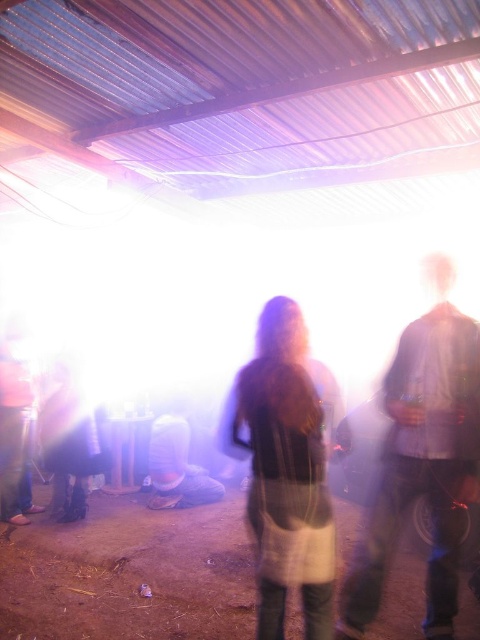
Question: Does shiny black boots at lower left have a lesser width compared to matte gray hat at center?

Choices:
 (A) no
 (B) yes

Answer: (B)

Question: Among these objects, which one is farthest from the camera?

Choices:
 (A) matte gray hat at center
 (B) light brown fabric dress at center

Answer: (A)

Question: Among these objects, which one is nearest to the camera?

Choices:
 (A) matte black pants at left
 (B) matte gray hat at center
 (C) light brown fabric dress at center
 (D) matte black jacket at center

Answer: (C)

Question: Can you confirm if matte black jacket at center is wider than shiny black boots at lower left?

Choices:
 (A) yes
 (B) no

Answer: (A)

Question: Is matte black jacket at center further to the viewer compared to matte gray hat at center?

Choices:
 (A) no
 (B) yes

Answer: (A)

Question: Which object is farther from the camera taking this photo?

Choices:
 (A) shiny black boots at lower left
 (B) light brown fabric dress at center
 (C) matte black pants at left

Answer: (A)